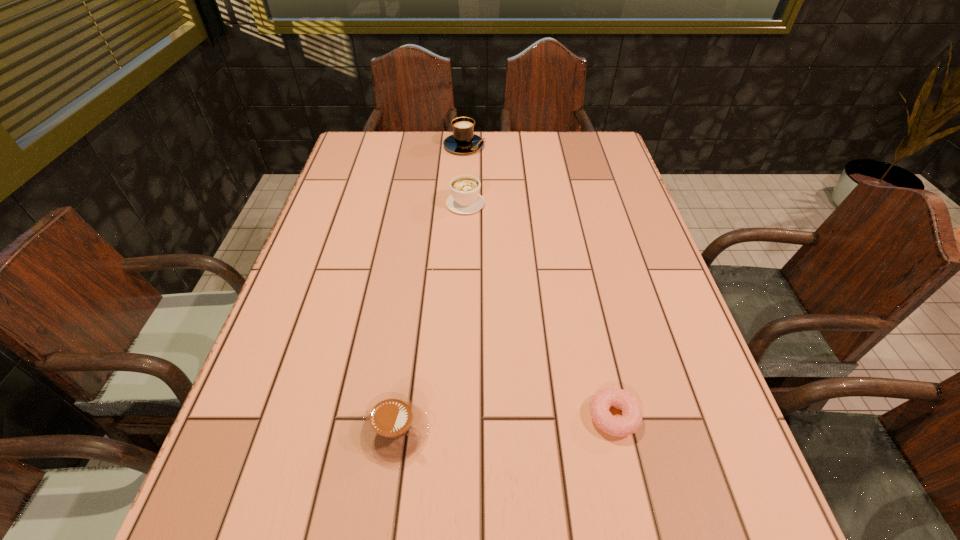
Identify which object is the third closest to the farthest cappuccino. Please provide its 2D coordinates. Your answer should be formatted as a tuple, i.e. [(x, y)], where the tuple contains the x and y coordinates of a point satisfying the conditions above.

[(630, 421)]

The height and width of the screenshot is (540, 960). Find the location of `cappuccino that is the second closest to the nearest cappuccino`. cappuccino that is the second closest to the nearest cappuccino is located at coordinates (463, 140).

Select which cappuccino appears as the closest to the shortest object. Please provide its 2D coordinates. Your answer should be formatted as a tuple, i.e. [(x, y)], where the tuple contains the x and y coordinates of a point satisfying the conditions above.

[(394, 427)]

Identify the location of free spot that satisfies the following two spatial constraints: 1. on the back side of the rightmost object; 2. on the left side of the nearest cappuccino. This screenshot has width=960, height=540. (396, 416).